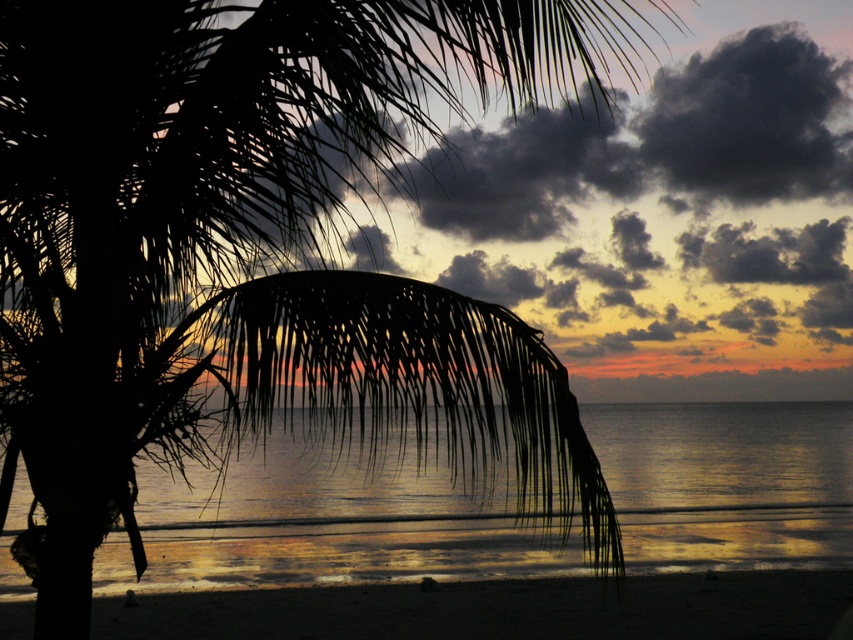
You are a photographer planning to capture the entire beach scene in one shot. Considering the composition, which object takes up more area in the image between the glistening silver water at center and the sandy beach at lower center?

The sandy beach at lower center occupies more space than the glistening silver water at center, so it takes up more area in the image.

You are standing on the sandy beach at lower center and want to walk to the glistening silver water at center. In which direction should you head?

You should head to the left because the glistening silver water at center is to the left of sandy beach at lower center.